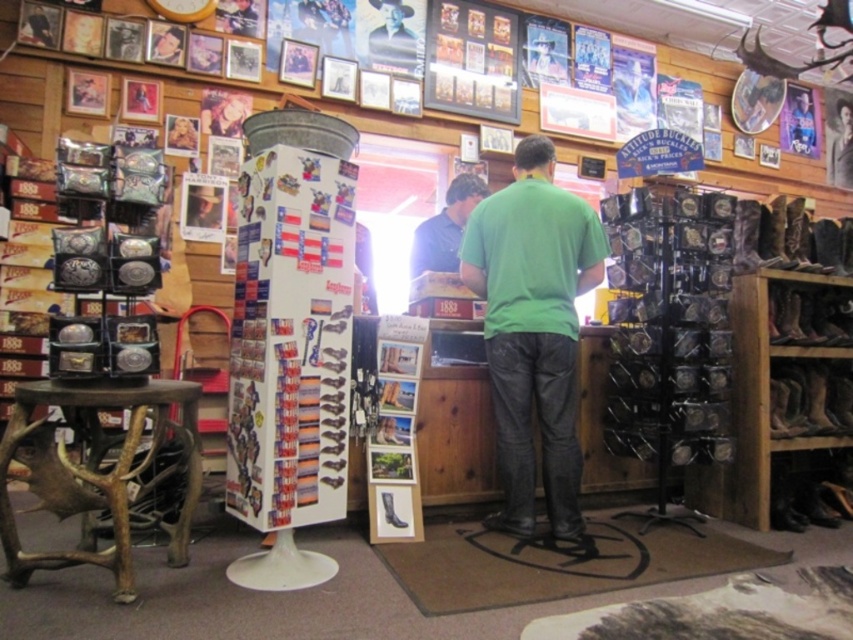
Is green matte shirt at center wider than matte blue shirt at center?

Correct, the width of green matte shirt at center exceeds that of matte blue shirt at center.

Measure the distance between green matte shirt at center and camera.

2.87 meters

Consider the image. Who is more distant from viewer, (468, 228) or (453, 260)?

Point (453, 260)

This screenshot has height=640, width=853. In order to click on green matte shirt at center in this screenshot , I will do [x=532, y=328].

Between matte blue shirt at center and rugged leather cowboy hat at upper center, which one has more height?

matte blue shirt at center is taller.

Who is more distant from viewer, (427, 252) or (398, 28)?

Positioned behind is point (398, 28).

Does point (428, 236) come in front of point (398, 52)?

Yes.

The width and height of the screenshot is (853, 640). Identify the location of matte blue shirt at center. (445, 227).

Does brown wooden stool at lower left have a greater width compared to matte blue shirt at center?

Correct, the width of brown wooden stool at lower left exceeds that of matte blue shirt at center.

Image resolution: width=853 pixels, height=640 pixels. What do you see at coordinates (97, 472) in the screenshot?
I see `brown wooden stool at lower left` at bounding box center [97, 472].

Locate an element on the screen. brown wooden stool at lower left is located at coordinates (97, 472).